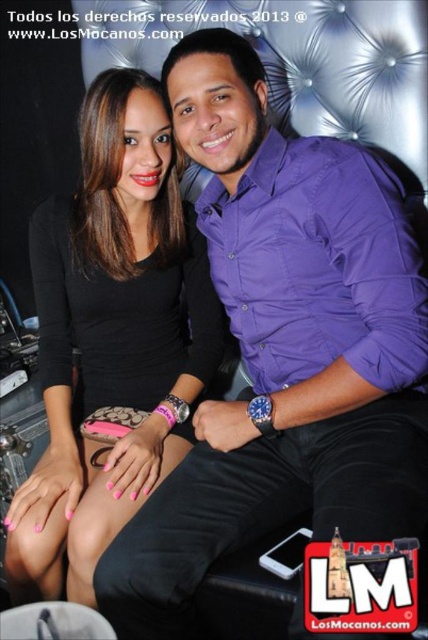
Who is lower down, purple satin shirt at center or black matte dress at center?

black matte dress at center

Which is more to the left, purple satin shirt at center or black matte dress at center?

black matte dress at center

Is point (237, 83) less distant than point (171, 458)?

Yes, it is.

Find the location of a particular element. The height and width of the screenshot is (640, 428). purple satin shirt at center is located at coordinates (284, 348).